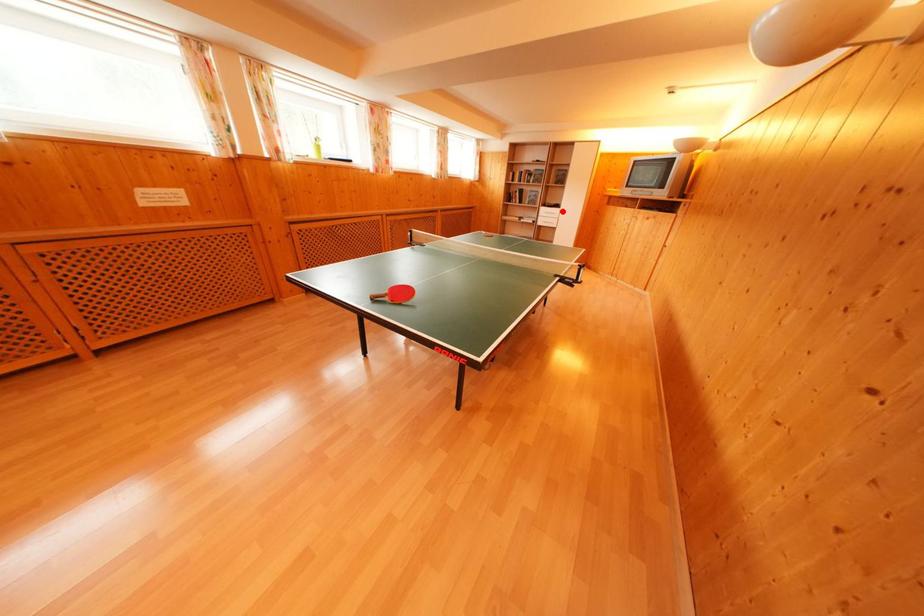
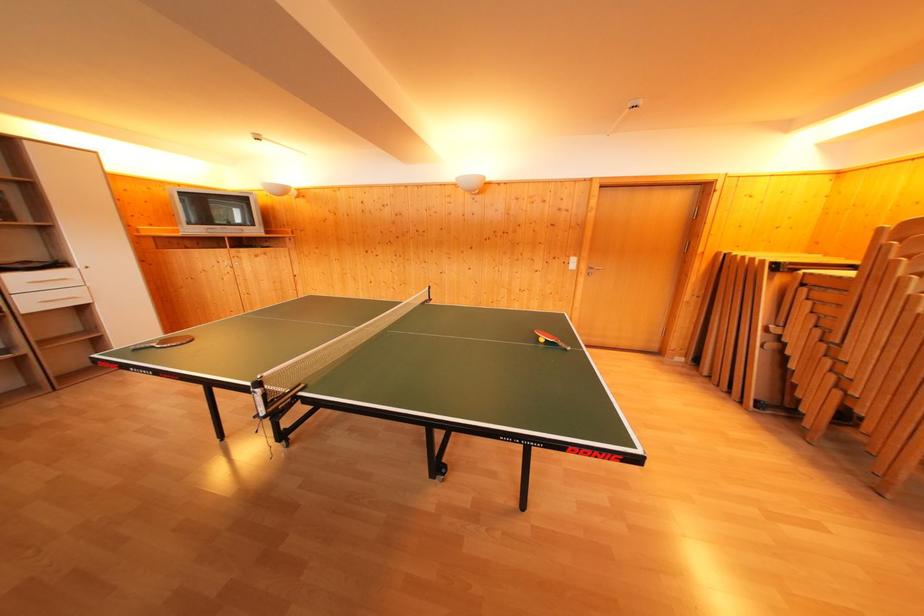
Question: A red point is marked in image1. In image2, is the corresponding 3D point closer to the camera or farther? Reply with the corresponding letter.

Choices:
 (A) The corresponding 3D point is closer.
 (B) The corresponding 3D point is farther.

Answer: (B)